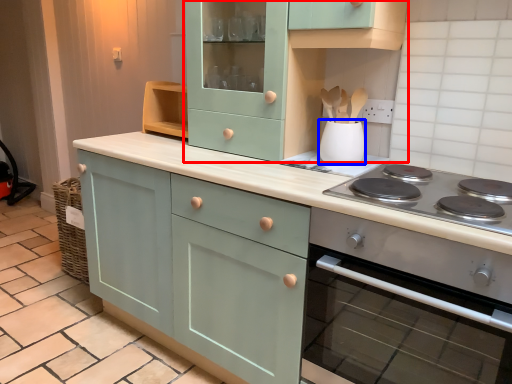
Question: Which of the following is the farthest to the observer, cabinetry (highlighted by a red box) or kitchen appliance (highlighted by a blue box)?

Choices:
 (A) cabinetry
 (B) kitchen appliance

Answer: (B)